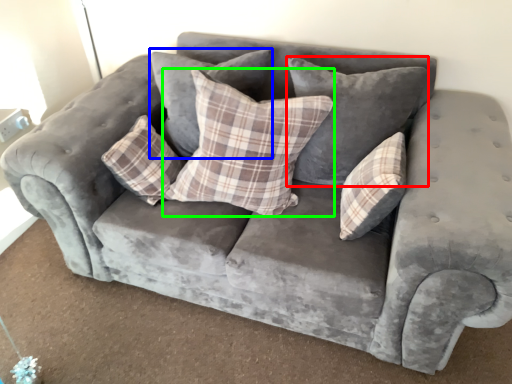
Question: Which object is positioned closest to pillow (highlighted by a red box)? Select from pillow (highlighted by a blue box) and pillow (highlighted by a green box).

Choices:
 (A) pillow
 (B) pillow

Answer: (B)